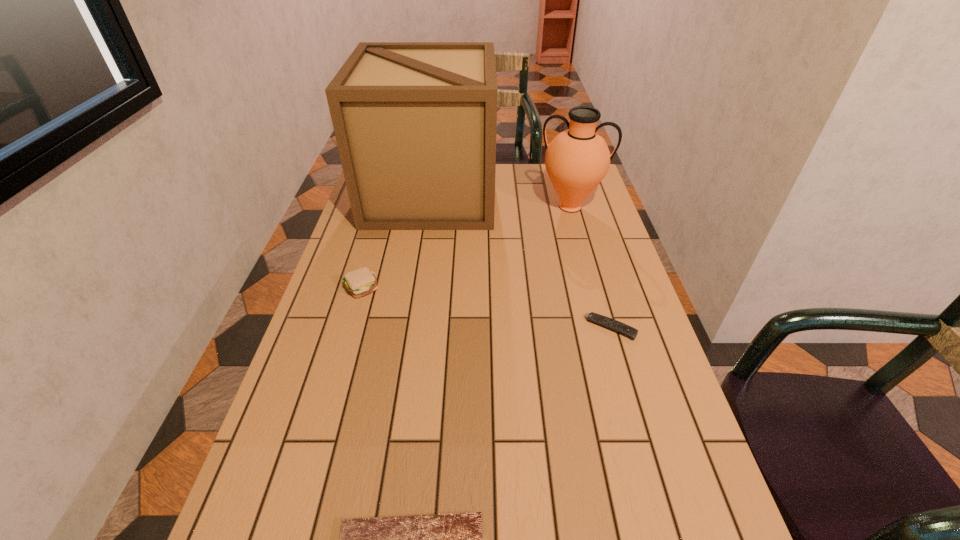
Locate an element on the screen. The height and width of the screenshot is (540, 960). box positioned at the far edge is located at coordinates (415, 123).

The width and height of the screenshot is (960, 540). I want to click on pitcher that is at the far edge, so click(x=577, y=159).

Locate an element on the screen. This screenshot has width=960, height=540. box positioned at the left edge is located at coordinates (415, 123).

Locate an element on the screen. The image size is (960, 540). patty at the left edge is located at coordinates (359, 282).

Locate an element on the screen. This screenshot has height=540, width=960. pitcher that is positioned at the right edge is located at coordinates (577, 159).

You are a GUI agent. You are given a task and a screenshot of the screen. Output one action in this format:
    pyautogui.click(x=<x>, y=<y>)
    Task: Click on the remote control located in the right edge section of the desktop
    
    Given the screenshot: What is the action you would take?
    [621, 328]

Image resolution: width=960 pixels, height=540 pixels. I want to click on object positioned at the far left corner, so click(415, 123).

Identify the location of object that is at the far right corner. (577, 159).

At what (x,y) coordinates should I click in order to perform the action: click on vacant space at the left edge. Please return your answer as a coordinate pair (x, y). The width and height of the screenshot is (960, 540). Looking at the image, I should click on (339, 266).

This screenshot has width=960, height=540. Identify the location of vacant region at the right edge of the desktop. (635, 384).